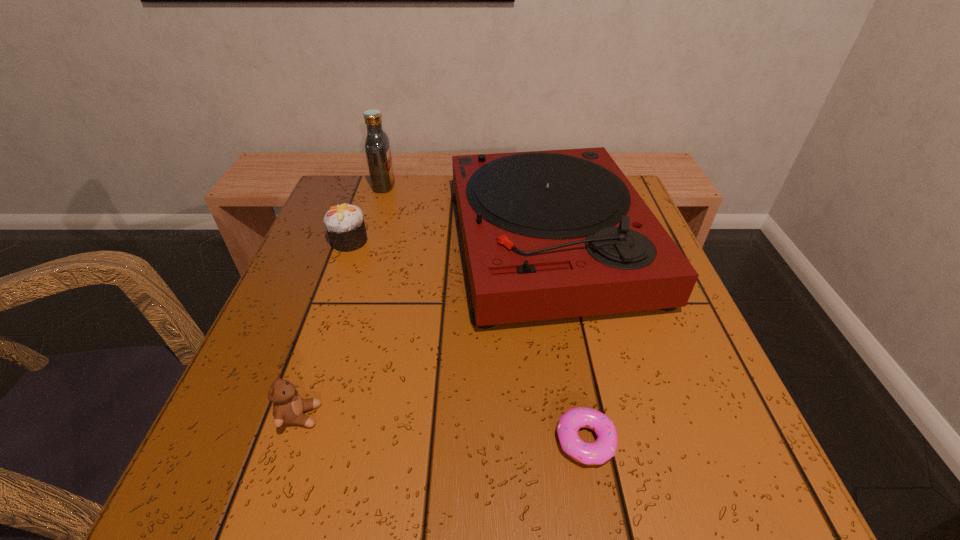
Find the location of a particular element. Image resolution: width=960 pixels, height=540 pixels. vacant area at the left edge is located at coordinates (371, 230).

This screenshot has height=540, width=960. What are the coordinates of `vacant space at the right edge of the desktop` in the screenshot? It's located at (616, 320).

Locate an element on the screen. vacant position at the near left corner of the desktop is located at coordinates (283, 461).

This screenshot has width=960, height=540. What are the coordinates of `free location at the near right corner of the desktop` in the screenshot? It's located at (731, 484).

This screenshot has width=960, height=540. In order to click on free space between the cupcake and the second tallest object in this screenshot , I will do `click(449, 242)`.

Find the location of `free spot between the teddy bear and the record player`. free spot between the teddy bear and the record player is located at coordinates (424, 329).

The image size is (960, 540). What are the coordinates of `vacant area that lies between the vodka and the teddy bear` in the screenshot? It's located at (342, 301).

Find the location of a particular element. This screenshot has height=540, width=960. vacant area between the doughnut and the cupcake is located at coordinates point(468,341).

Identify the location of vacant region between the doughnut and the teddy bear. The image size is (960, 540). (443, 428).

This screenshot has height=540, width=960. I want to click on vacant region between the teddy bear and the vodka, so click(342, 301).